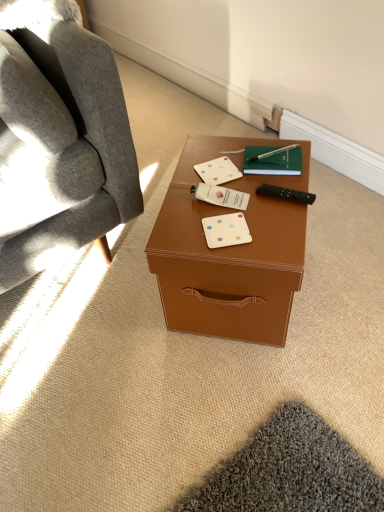
Image resolution: width=384 pixels, height=512 pixels. Identify the location of free point to the right of white matte business card at center, placed as the third business card when sorted from top to bottom. (274, 223).